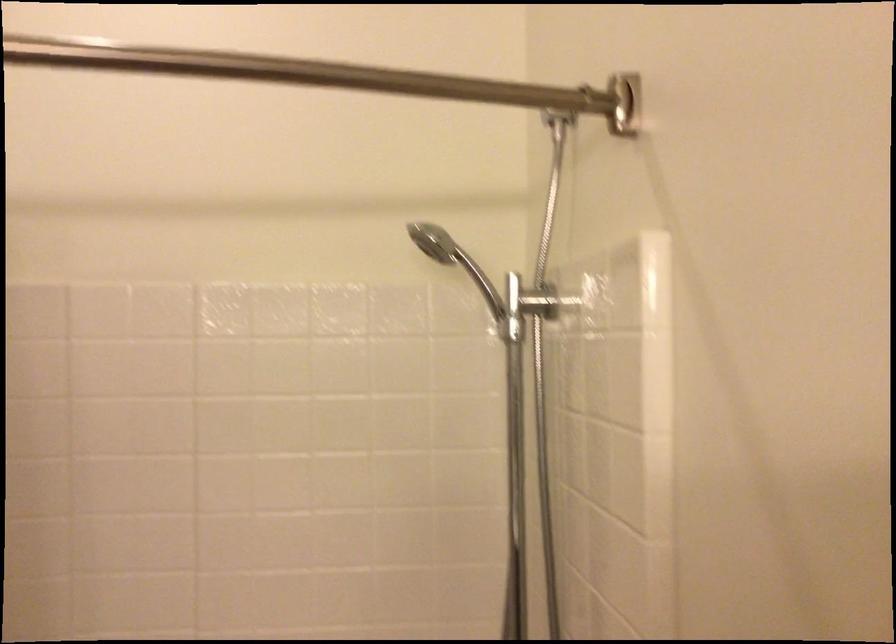
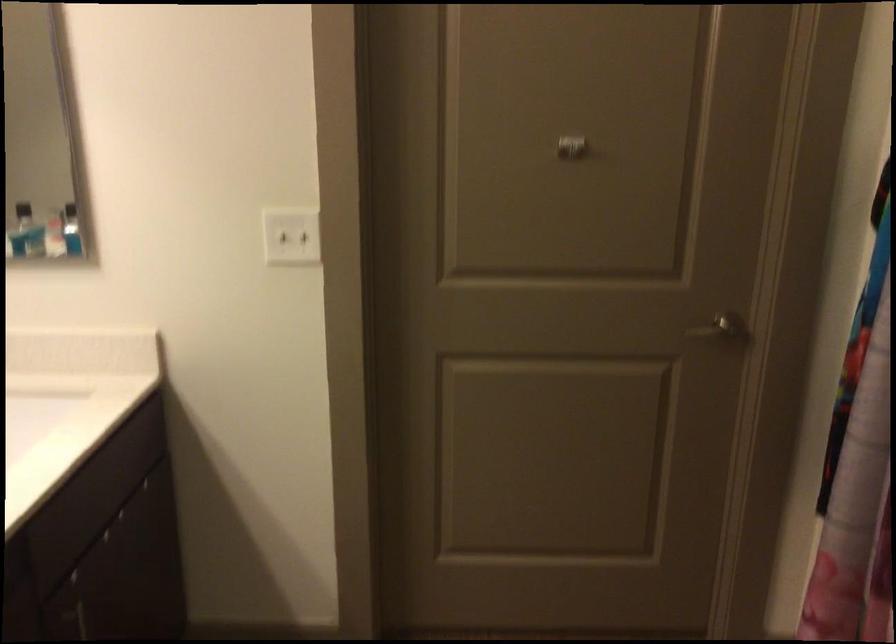
The images are taken continuously from a first-person perspective. In which direction is your viewpoint rotating?

The rotation direction of the camera is left-down.